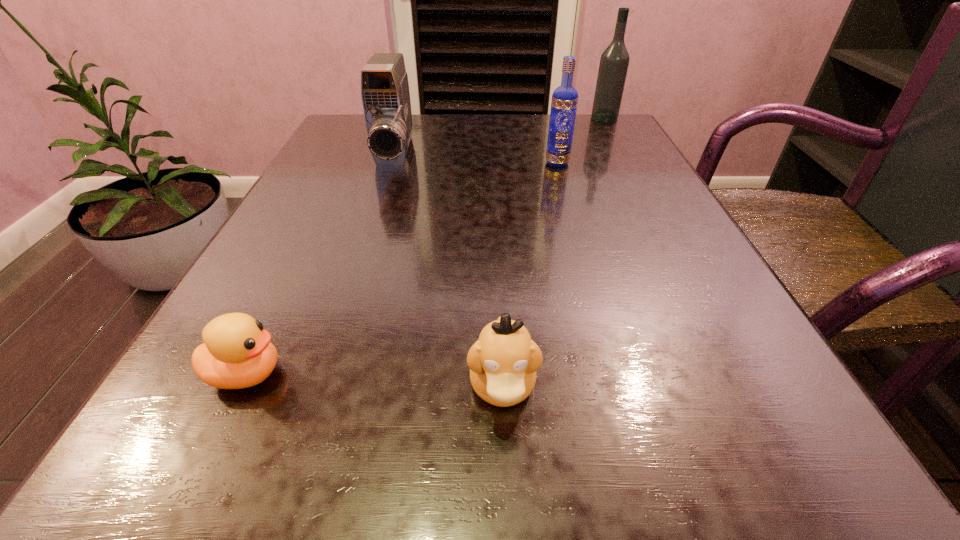
Locate an element on the screen. the right vodka is located at coordinates (614, 61).

The width and height of the screenshot is (960, 540). I want to click on the rightmost object, so click(614, 61).

Where is `the nearer vodka`? The height and width of the screenshot is (540, 960). the nearer vodka is located at coordinates (564, 102).

Find the location of `the left vodka`. the left vodka is located at coordinates (564, 102).

Image resolution: width=960 pixels, height=540 pixels. I want to click on camcorder, so click(385, 94).

I want to click on the right duckling, so click(503, 362).

The image size is (960, 540). Find the location of `the taller duckling`. the taller duckling is located at coordinates (503, 362).

Identify the location of the leftmost object. This screenshot has height=540, width=960. (236, 353).

This screenshot has height=540, width=960. In order to click on the left duckling in this screenshot , I will do `click(236, 353)`.

The width and height of the screenshot is (960, 540). I want to click on free location located 0.200m on the left of the farther vodka, so click(511, 118).